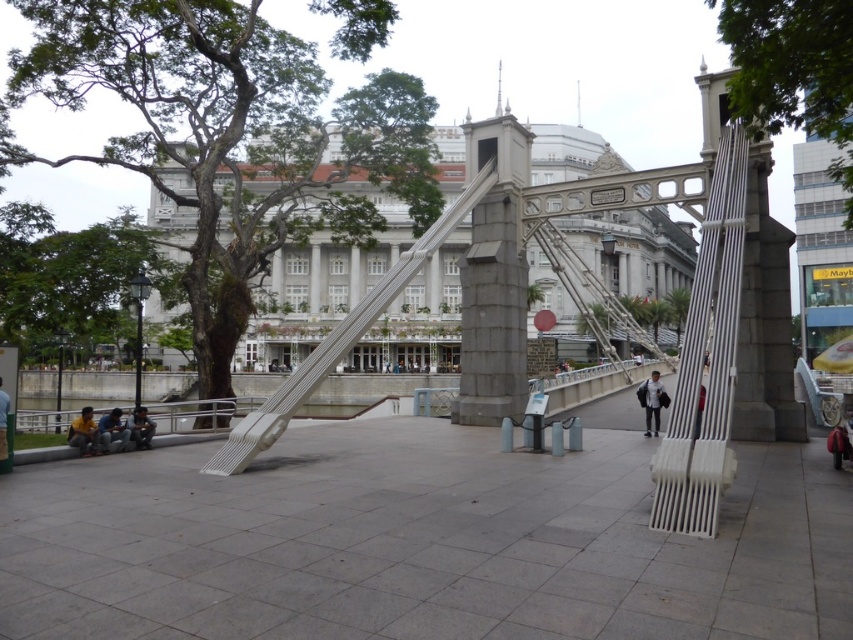
Question: Considering the real-world distances, which object is farthest from the blue jeans at lower left?

Choices:
 (A) yellow shirt at lower left
 (B) dark blue jeans at lower left
 (C) green leafy tree at left
 (D) matte white bench at center

Answer: (C)

Question: Does white metallic suspension bridge at center appear over yellow shirt at lower left?

Choices:
 (A) yes
 (B) no

Answer: (A)

Question: Which is farther from the yellow shirt at lower left?

Choices:
 (A) blue jeans at lower left
 (B) green leafy tree at center
 (C) matte white bench at center
 (D) white metallic suspension bridge at center

Answer: (B)

Question: Is green leafy tree at left below dark blue jeans at lower left?

Choices:
 (A) yes
 (B) no

Answer: (B)

Question: Can you confirm if white metallic suspension bridge at center is positioned above white matte jacket at center?

Choices:
 (A) yes
 (B) no

Answer: (A)

Question: Which of the following is the farthest from the observer?

Choices:
 (A) yellow shirt at lower left
 (B) matte white bench at center

Answer: (A)